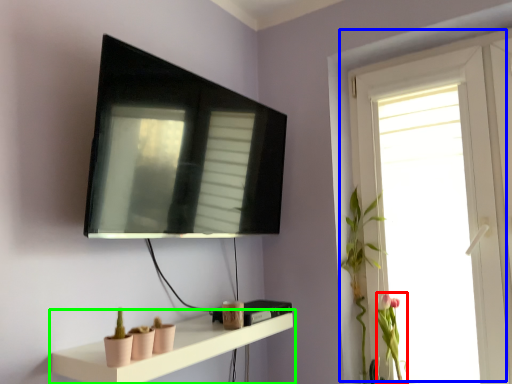
Question: Considering the real-world distances, which object is farthest from plant (highlighted by a red box)? window (highlighted by a blue box) or shelf (highlighted by a green box)?

Choices:
 (A) window
 (B) shelf

Answer: (B)